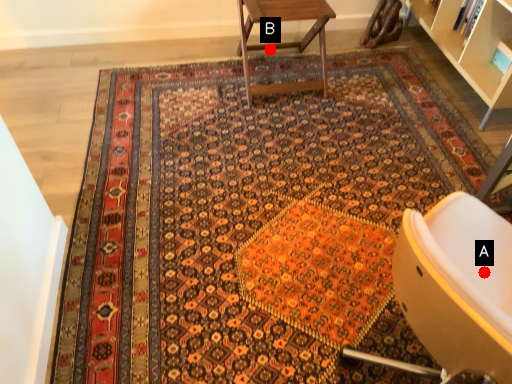
Question: Two points are circled on the image, labeled by A and B beside each circle. Which point is farther to the camera?

Choices:
 (A) A is further
 (B) B is further

Answer: (B)